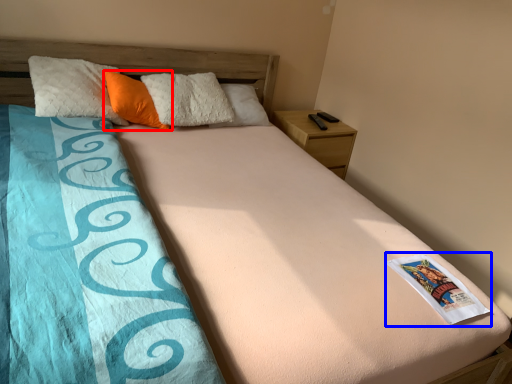
Question: Which object is further to the camera taking this photo, pillow (highlighted by a red box) or paperback book (highlighted by a blue box)?

Choices:
 (A) pillow
 (B) paperback book

Answer: (A)